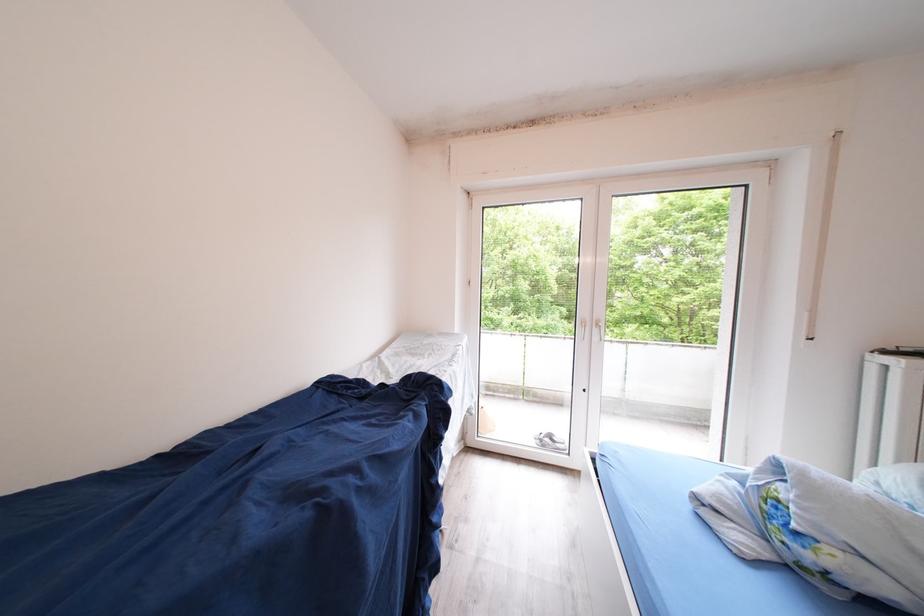
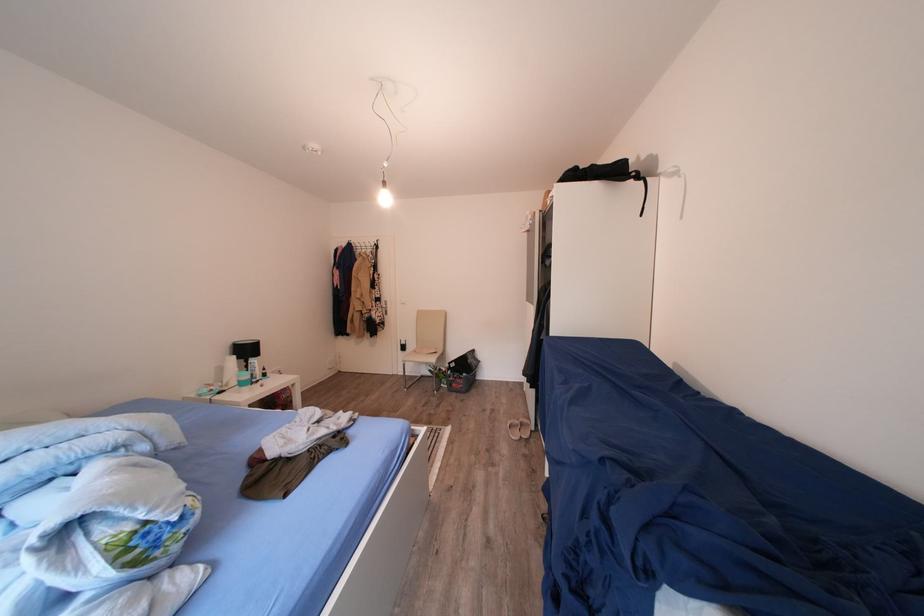
Question: I am providing you with two images of the same scene from different viewpoints. Please identify which objects are invisible in image2.

Choices:
 (A) white plastic bottle
 (B) silver door handle
 (C) white spray bottle
 (D) none of these

Answer: (D)